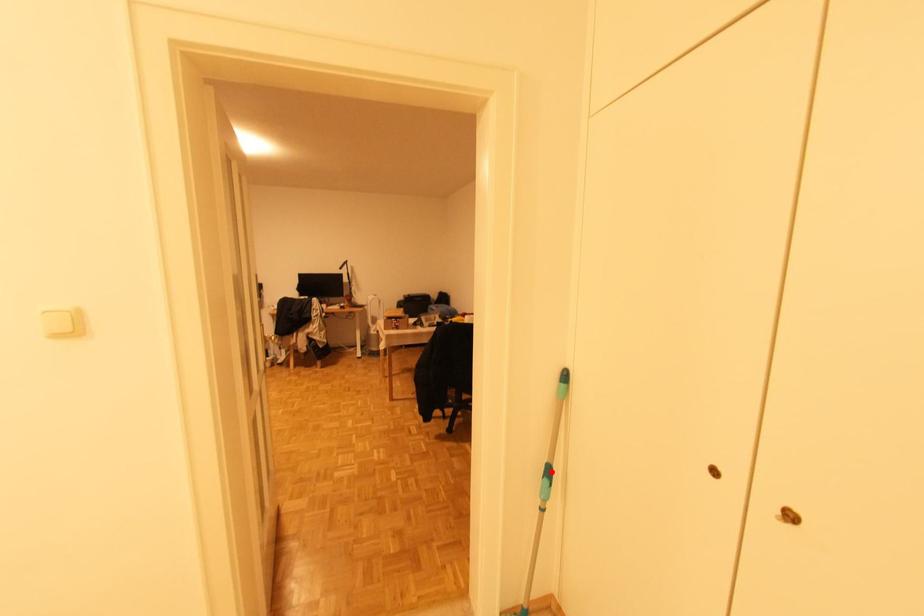
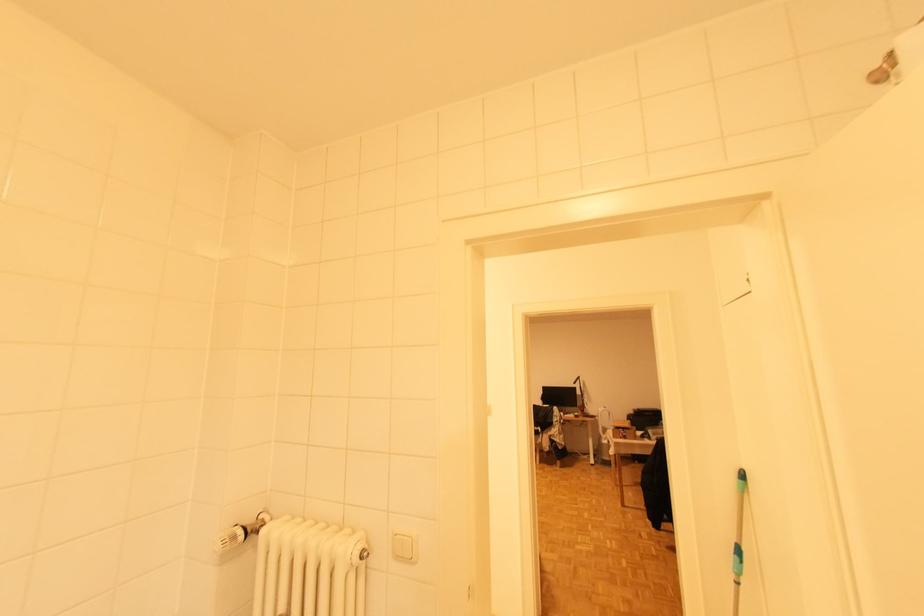
Find the pixel in the second image that matches the highlighted location in the first image.

(742, 552)